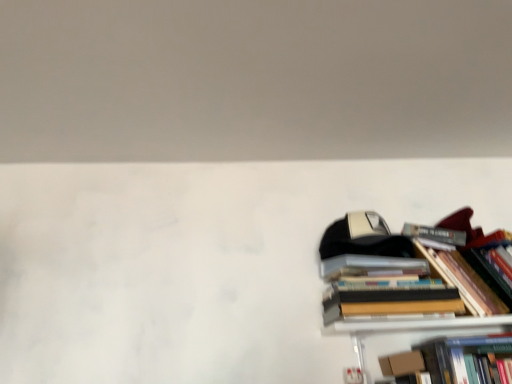
Image resolution: width=512 pixels, height=384 pixels. What do you see at coordinates (395, 276) in the screenshot?
I see `hardcover books at right` at bounding box center [395, 276].

At what (x,y) coordinates should I click in order to perform the action: click on hardcover books at right. Please return your answer as a coordinate pair (x, y). Looking at the image, I should click on (395, 276).

The width and height of the screenshot is (512, 384). Describe the element at coordinates (402, 363) in the screenshot. I see `hardcover book at lower right` at that location.

Locate an element on the screen. hardcover book at lower right is located at coordinates (402, 363).

The width and height of the screenshot is (512, 384). What are the coordinates of `hardcover books at right` in the screenshot? It's located at (395, 276).

Considering the positions of objects hardcover book at lower right and hardcover books at right in the image provided, who is more to the left, hardcover book at lower right or hardcover books at right?

From the viewer's perspective, hardcover book at lower right appears more on the left side.

Does hardcover book at lower right come in front of hardcover books at right?

No, the depth of hardcover book at lower right is greater than that of hardcover books at right.

Which point is more forward, (395, 354) or (341, 254)?

The point (341, 254) is closer to the camera.

From the image's perspective, is hardcover book at lower right located beneath hardcover books at right?

Yes.

From a real-world perspective, who is located higher, hardcover book at lower right or hardcover books at right?

In real-world perspective, hardcover books at right is above.

Looking at this image, can you confirm if hardcover book at lower right is thinner than hardcover books at right?

Yes.

Is hardcover book at lower right taller or shorter than hardcover books at right?

Considering their sizes, hardcover book at lower right has less height than hardcover books at right.

Does hardcover book at lower right have a larger size compared to hardcover books at right?

No.

Is hardcover book at lower right not inside hardcover books at right?

hardcover book at lower right lies outside hardcover books at right's area.

Is hardcover book at lower right not near hardcover books at right?

They are positioned close to each other.

Is hardcover book at lower right facing towards hardcover books at right?

No, hardcover book at lower right is not oriented towards hardcover books at right.

How different are the orientations of hardcover book at lower right and hardcover books at right in degrees?

4.95 degrees.

Where is `book in front of the hardcover book at lower right`? The height and width of the screenshot is (384, 512). book in front of the hardcover book at lower right is located at coordinates (395, 276).

Visually, is hardcover books at right positioned to the left or to the right of hardcover book at lower right?

Clearly, hardcover books at right is on the right of hardcover book at lower right in the image.

Considering the positions of objects hardcover books at right and hardcover book at lower right in the image provided, who is behind, hardcover books at right or hardcover book at lower right?

hardcover book at lower right is behind.

Which is behind, point (424, 287) or point (386, 356)?

The point (386, 356) is farther.

Consider the image. From the image's perspective, which one is positioned higher, hardcover books at right or hardcover book at lower right?

From the image's view, hardcover books at right is above.

From a real-world perspective, is hardcover books at right on hardcover book at lower right?

Yes, from a real-world perspective, hardcover books at right is on top of hardcover book at lower right.

Considering the sizes of hardcover books at right and hardcover book at lower right in the image, is hardcover books at right wider or thinner than hardcover book at lower right?

Considering their sizes, hardcover books at right looks broader than hardcover book at lower right.

Considering the sizes of hardcover books at right and hardcover book at lower right in the image, is hardcover books at right taller or shorter than hardcover book at lower right?

Clearly, hardcover books at right is taller compared to hardcover book at lower right.

Between hardcover books at right and hardcover book at lower right, which one has smaller size?

Smaller between the two is hardcover book at lower right.

Is hardcover books at right spatially inside hardcover book at lower right, or outside of it?

hardcover books at right lies outside hardcover book at lower right.

Is hardcover books at right directly adjacent to hardcover book at lower right?

They are not placed beside each other.

Is hardcover books at right oriented away from hardcover book at lower right?

No, hardcover books at right's orientation is not away from hardcover book at lower right.

What's the angular difference between hardcover books at right and hardcover book at lower right's facing directions?

They differ by 4.95 degrees in their facing directions.

Measure the distance between hardcover books at right and hardcover book at lower right.

hardcover books at right is 9.42 inches from hardcover book at lower right.

Locate an element on the screen. The image size is (512, 384). book on the right of hardcover book at lower right is located at coordinates point(395,276).

Where is `paperback book lying on the left of hardcover books at right`? The image size is (512, 384). paperback book lying on the left of hardcover books at right is located at coordinates (402, 363).

In the image, there is a hardcover books at right. At what (x,y) coordinates should I click in order to perform the action: click on paperback book below it (from a real-world perspective). Please return your answer as a coordinate pair (x, y). Looking at the image, I should click on (402, 363).